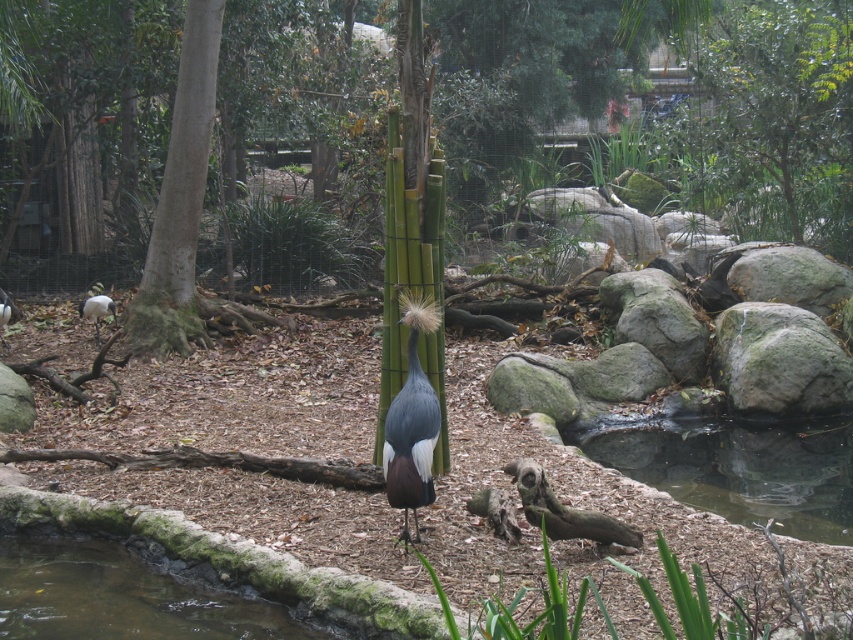
You are a zookeeper preparing to clean the enclosure. You need to place a new feeding platform in the clear water at pond center. However, there is a brown smooth tree at left nearby. Where should you position the platform to avoid the tree?

The clear water at pond center is positioned under brown smooth tree at left, so placing the feeding platform there would position it directly beneath the tree. To avoid the tree, the platform should be placed elsewhere in the enclosure away from the brown smooth tree at left.

You are a zookeeper standing at the camera position. You need to place a food dish for the gray matte bird at center. The dish must be placed within 15 feet of the bird. Can you place it within that distance?

The gray matte bird at center is 17.34 feet from the camera, which is farther than the 15 feet requirement. Therefore, you cannot place the dish within the required distance.